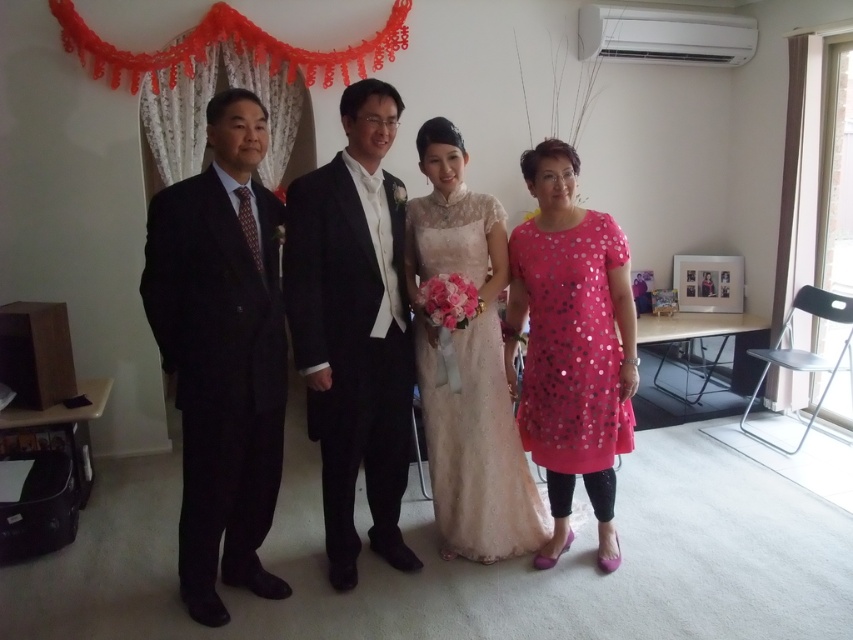
Question: Is dark suit at left to the right of satin lace dress at center from the viewer's perspective?

Choices:
 (A) yes
 (B) no

Answer: (B)

Question: Is dark suit at left to the left of pink sequined dress at right from the viewer's perspective?

Choices:
 (A) yes
 (B) no

Answer: (A)

Question: Estimate the real-world distances between objects in this image. Which object is farther from the shiny black suit at center?

Choices:
 (A) dark suit at left
 (B) satin lace dress at center
 (C) pink sequined dress at right

Answer: (C)

Question: Estimate the real-world distances between objects in this image. Which object is closer to the shiny black suit at center?

Choices:
 (A) dark suit at left
 (B) satin lace dress at center
 (C) pink sequined dress at right

Answer: (B)

Question: Can you confirm if dark suit at left is thinner than pink sequined dress at right?

Choices:
 (A) no
 (B) yes

Answer: (B)

Question: Which object is positioned closest to the satin lace dress at center?

Choices:
 (A) pink sequined dress at right
 (B) dark suit at left
 (C) shiny black suit at center

Answer: (A)